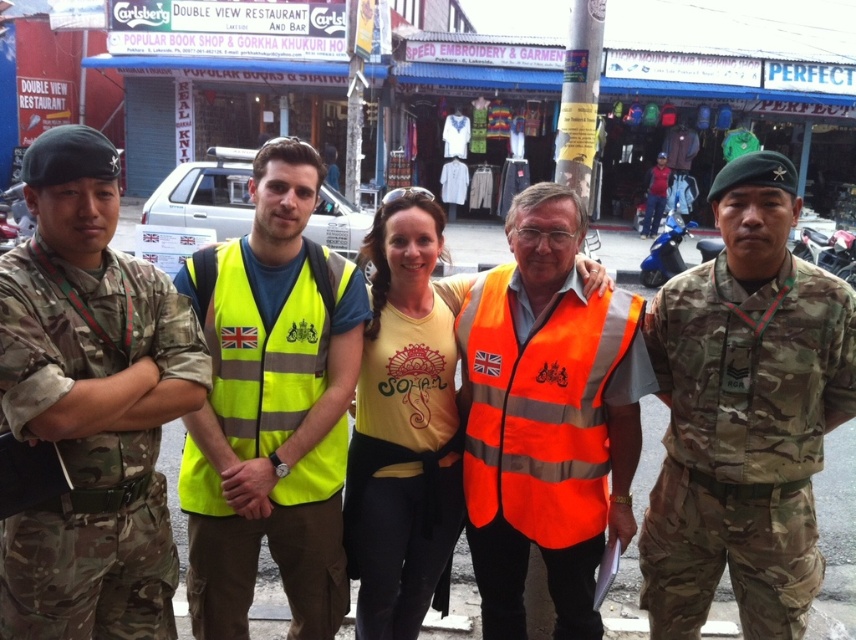
Question: Considering the real-world distances, which object is farthest from the yellow fabric tank top at center?

Choices:
 (A) yellow t-shirt at center
 (B) camouflage uniform at left

Answer: (B)

Question: Is yellow reflective vest at center above orange reflective safety vest at center?

Choices:
 (A) yes
 (B) no

Answer: (A)

Question: Can you confirm if camouflage uniform at left is thinner than yellow reflective safety vest at center?

Choices:
 (A) no
 (B) yes

Answer: (A)

Question: Which object is farther from the camera taking this photo?

Choices:
 (A) yellow reflective safety vest at center
 (B) camo uniform at right
 (C) yellow t-shirt at center

Answer: (A)

Question: Among these points, which one is nearest to the camera?

Choices:
 (A) (663, 202)
 (B) (340, 342)
 (C) (377, 404)

Answer: (B)

Question: Observing the image, what is the correct spatial positioning of camouflage uniform at left in reference to yellow reflective safety vest at center?

Choices:
 (A) above
 (B) below

Answer: (B)